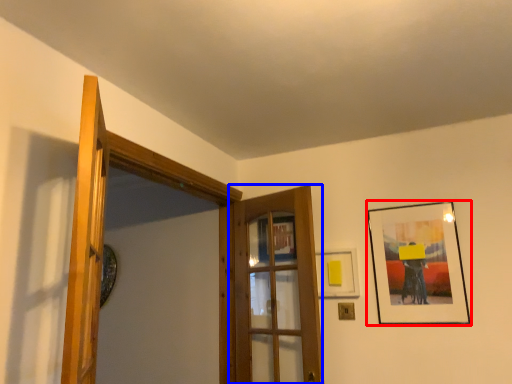
Question: Among these objects, which one is nearest to the camera, picture frame (highlighted by a red box) or door (highlighted by a blue box)?

Choices:
 (A) picture frame
 (B) door

Answer: (B)